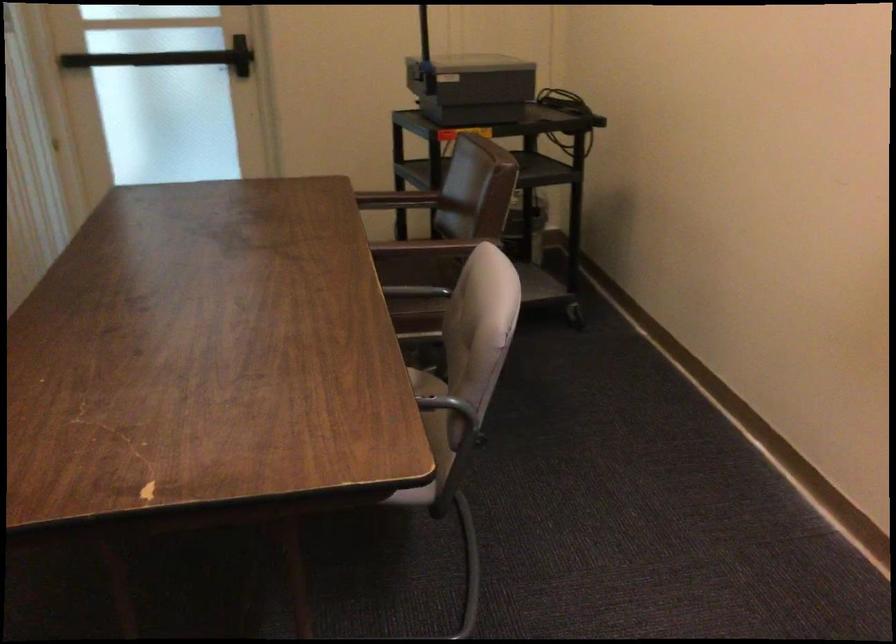
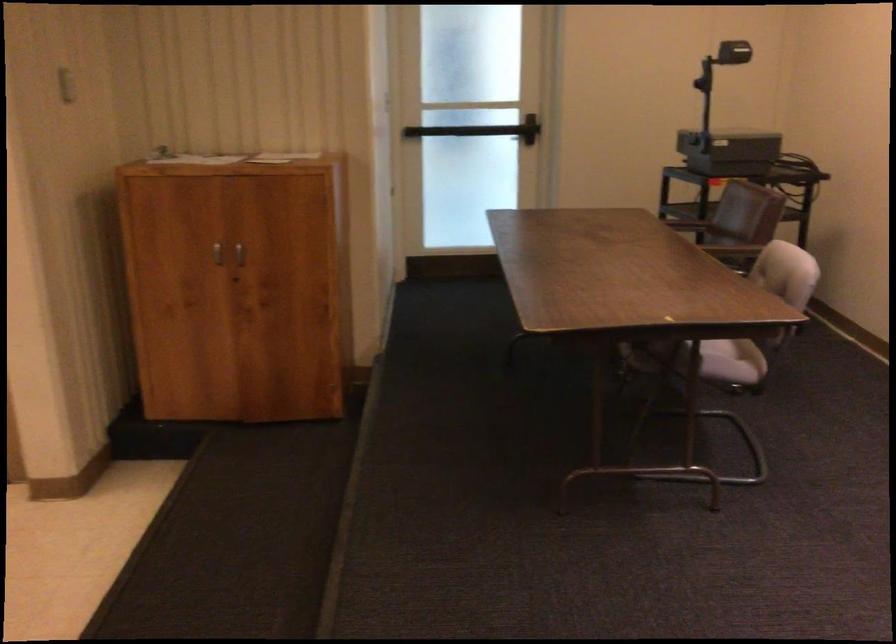
The images are taken continuously from a first-person perspective. In which direction are you moving?

The cameraman walked toward left, backward.